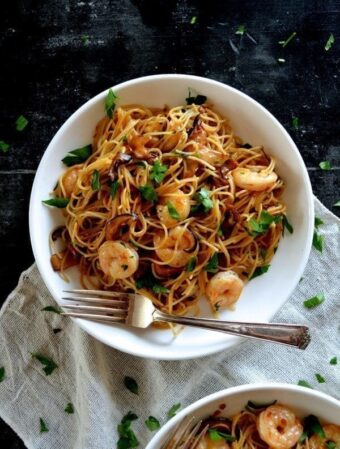
In order to click on fork in this screenshot , I will do `click(146, 309)`, `click(178, 438)`.